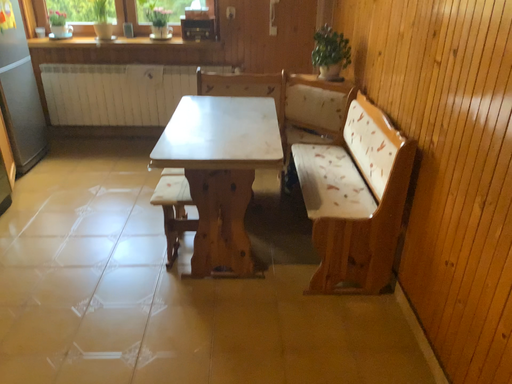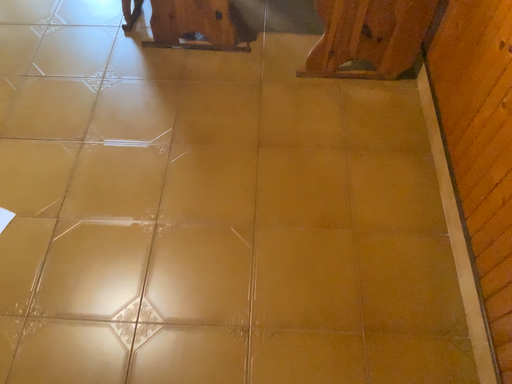
Question: How did the camera likely rotate when shooting the video?

Choices:
 (A) rotated downward
 (B) rotated upward

Answer: (A)